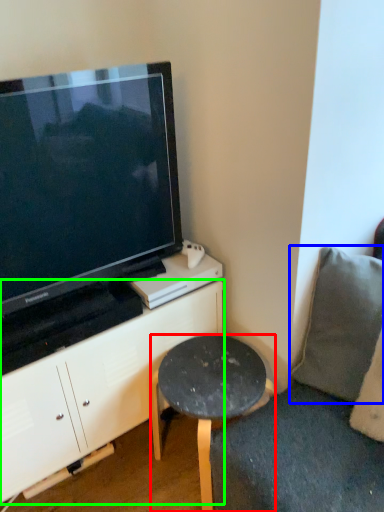
Question: Based on their relative distances, which object is farther from stool (highlighted by a red box)? Choose from pillow (highlighted by a blue box) and cabinetry (highlighted by a green box).

Choices:
 (A) pillow
 (B) cabinetry

Answer: (A)